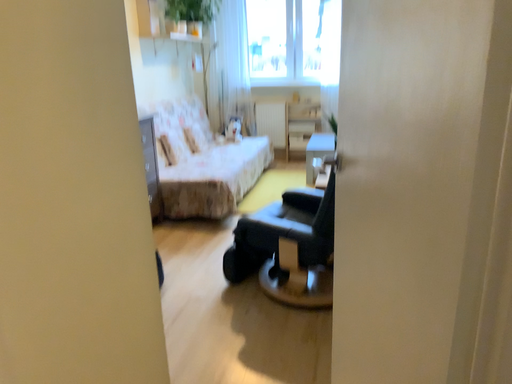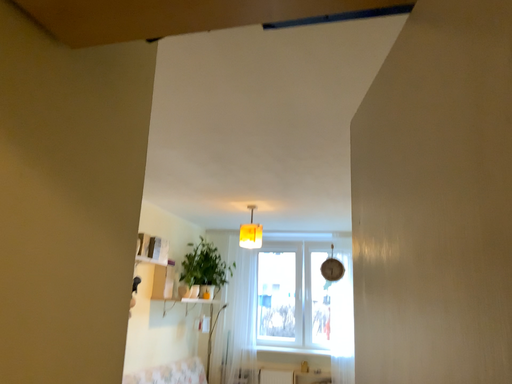
Question: How did the camera likely rotate when shooting the video?

Choices:
 (A) rotated downward
 (B) rotated upward

Answer: (B)